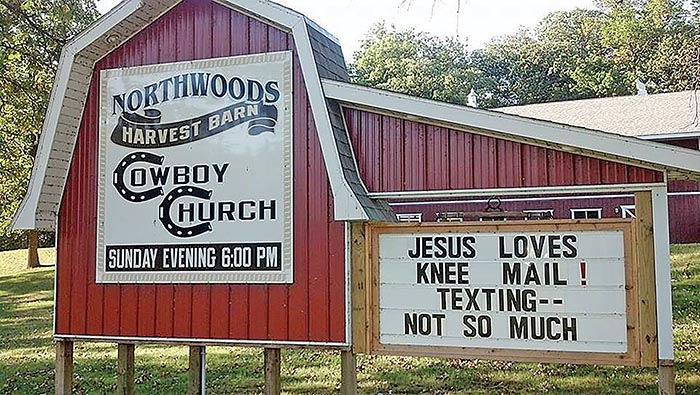
Find the location of `wood frame`. wood frame is located at coordinates (367, 294).